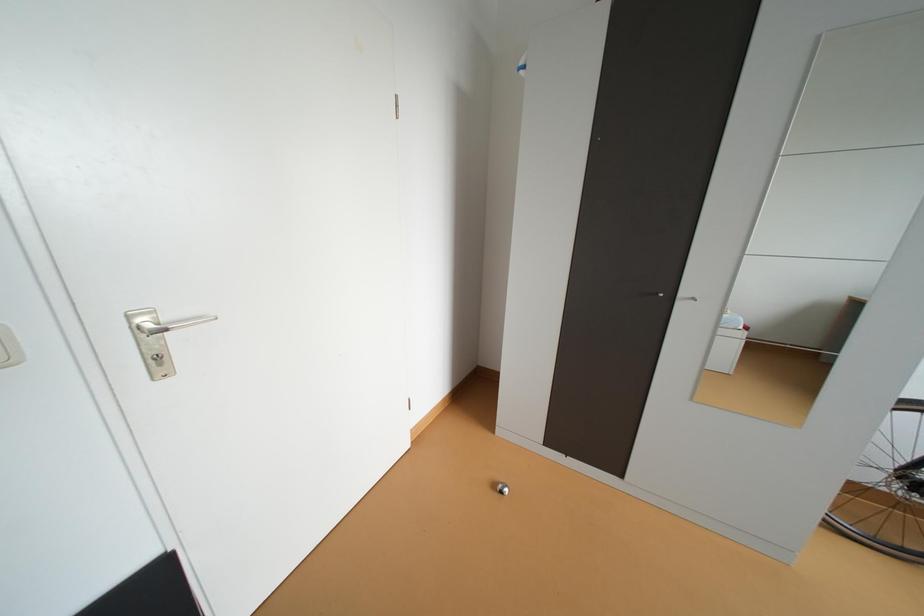
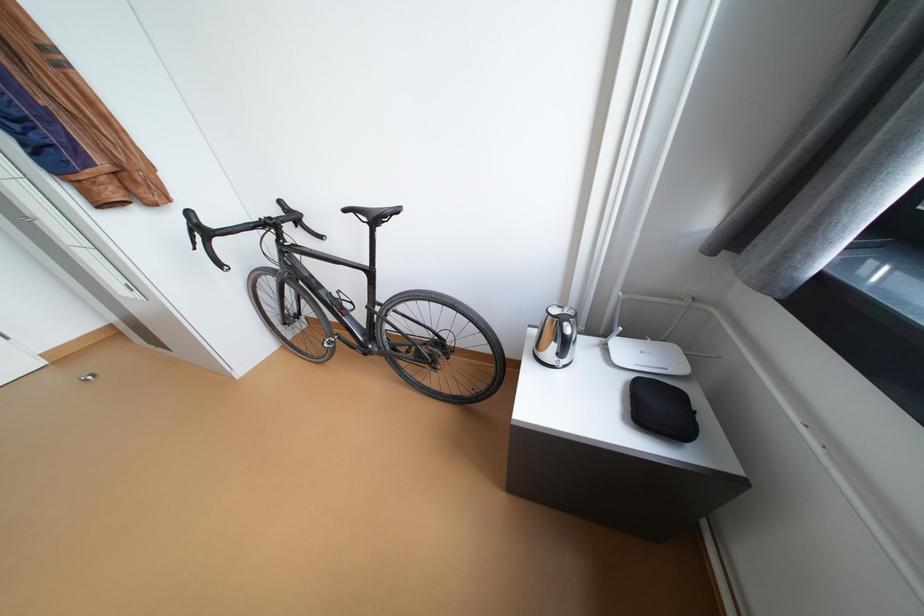
Question: The images are taken continuously from a first-person perspective. In which direction are you moving?

Choices:
 (A) Left
 (B) Right
 (C) Forward
 (D) Backward

Answer: (B)